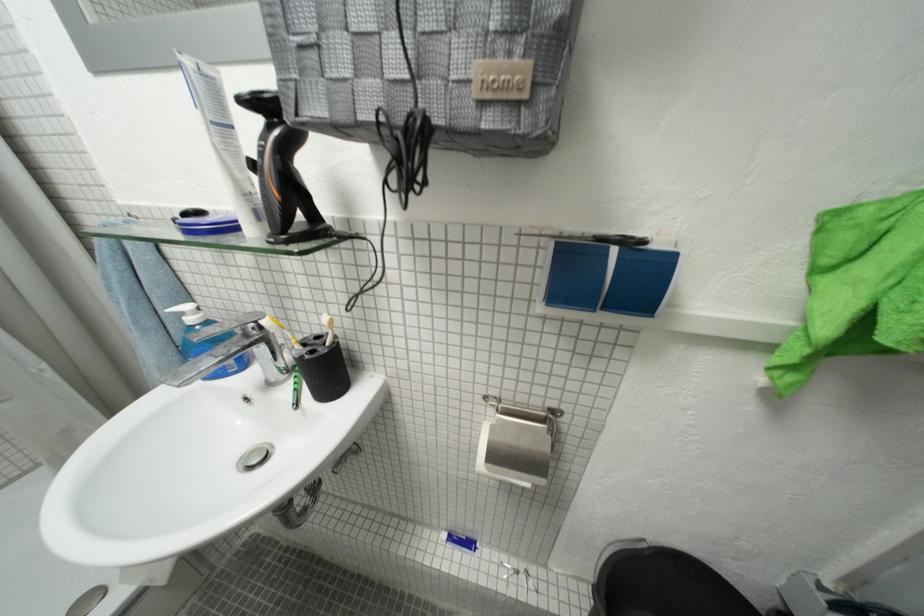
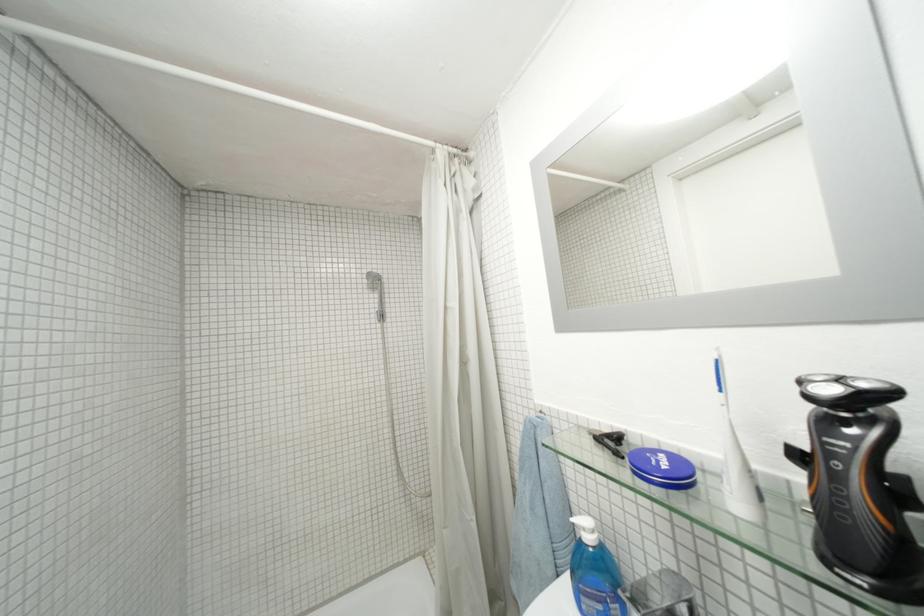
How did the camera likely rotate?

The rotation direction of the camera is left-up.